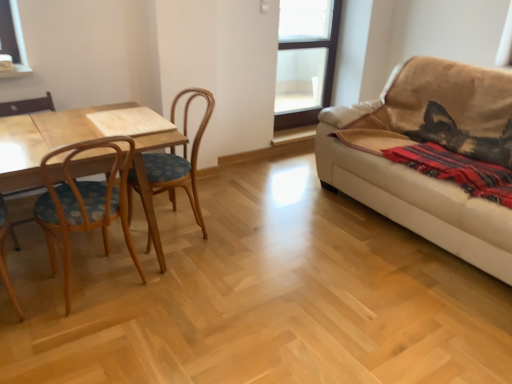
You are a GUI agent. You are given a task and a screenshot of the screen. Output one action in this format:
    pyautogui.click(x=<x>, y=<y>)
    Task: Click on the free spot to the right of woodenchair at left
    This screenshot has height=384, width=512.
    Given the screenshot: What is the action you would take?
    pyautogui.click(x=241, y=233)